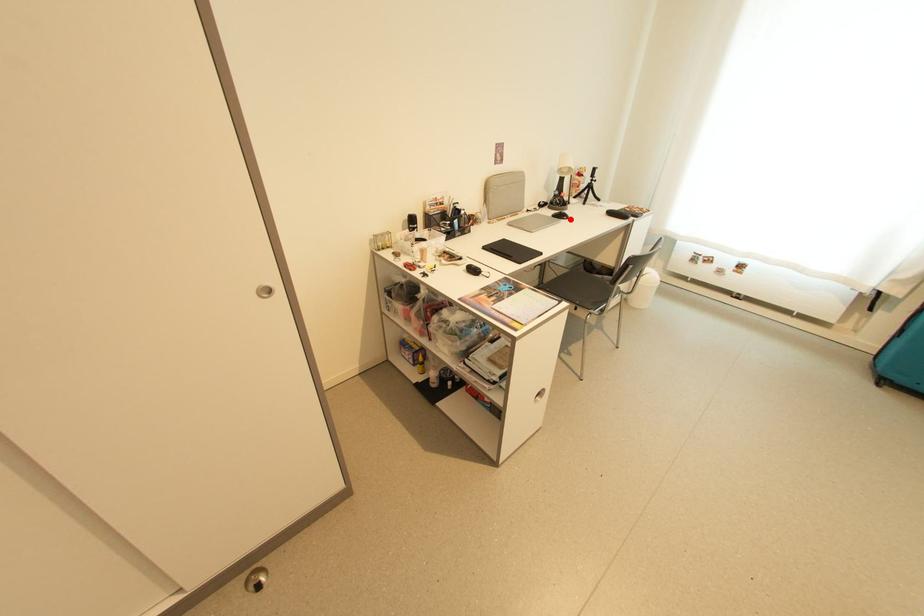
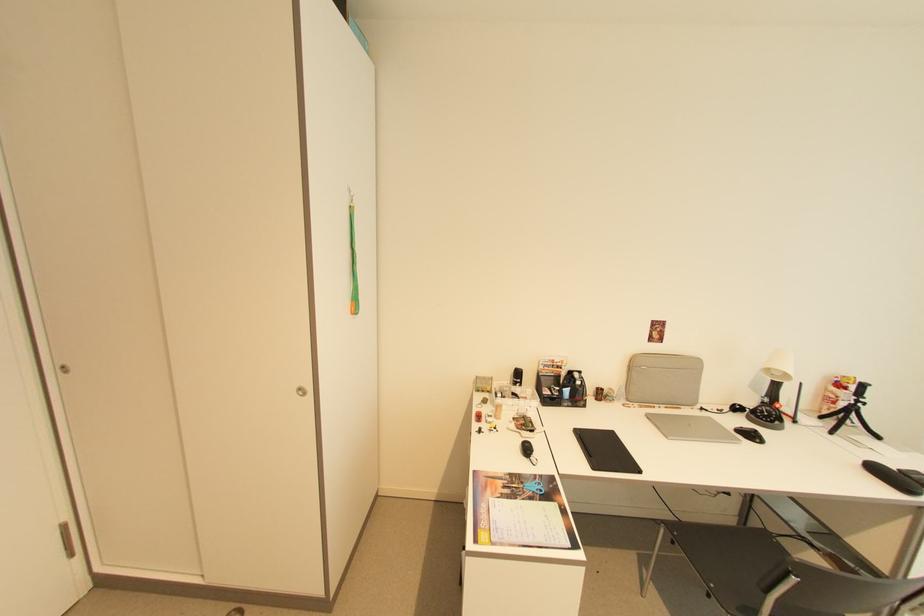
The point at the highlighted location is marked in the first image. Where is the corresponding point in the second image?

(762, 442)